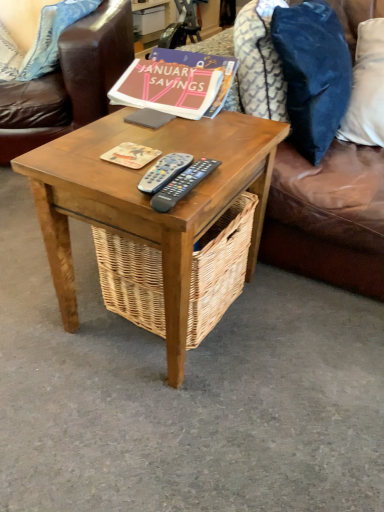
You are a GUI agent. You are given a task and a screenshot of the screen. Output one action in this format:
    pyautogui.click(x=<x>, y=<y>)
    Task: Click on the free space between black plastic remote at center, which is the 1th remote control from left to right, and matte cardboard coaster at center, which is the first book in bottom-to-top order
    Image resolution: width=384 pixels, height=512 pixels.
    Given the screenshot: What is the action you would take?
    pyautogui.click(x=128, y=172)